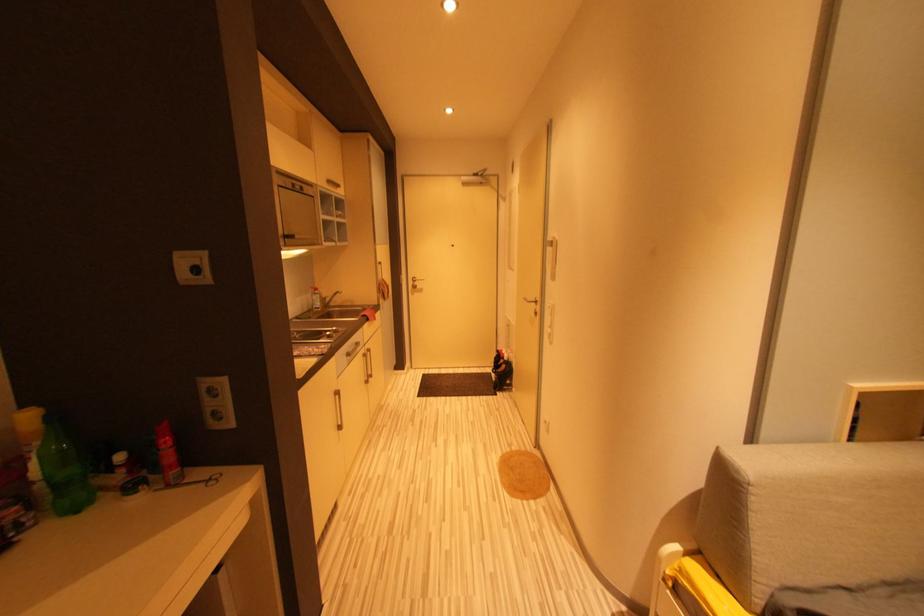
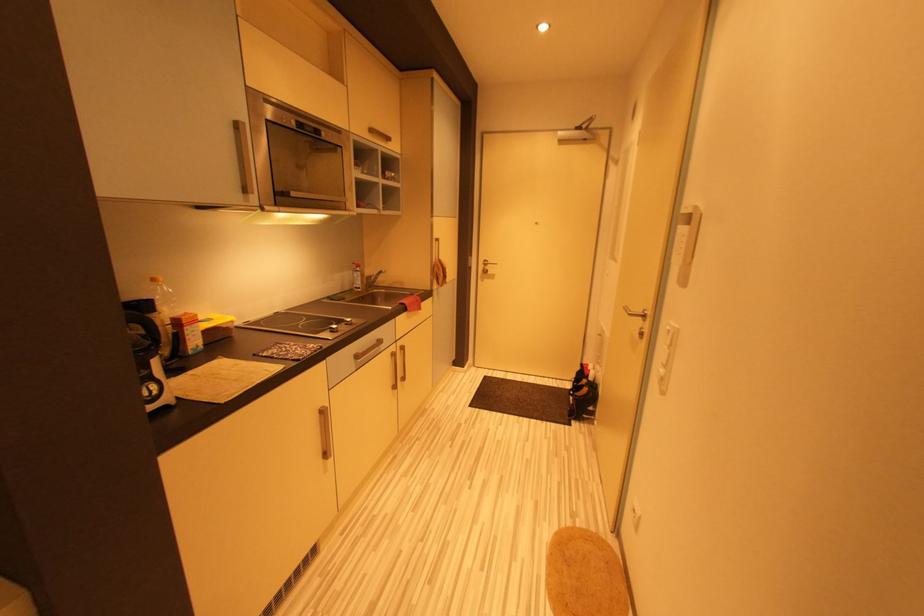
Question: In a continuous first-person perspective shot, in which direction is the camera moving?

Choices:
 (A) Left
 (B) Right
 (C) Forward
 (D) Backward

Answer: (C)